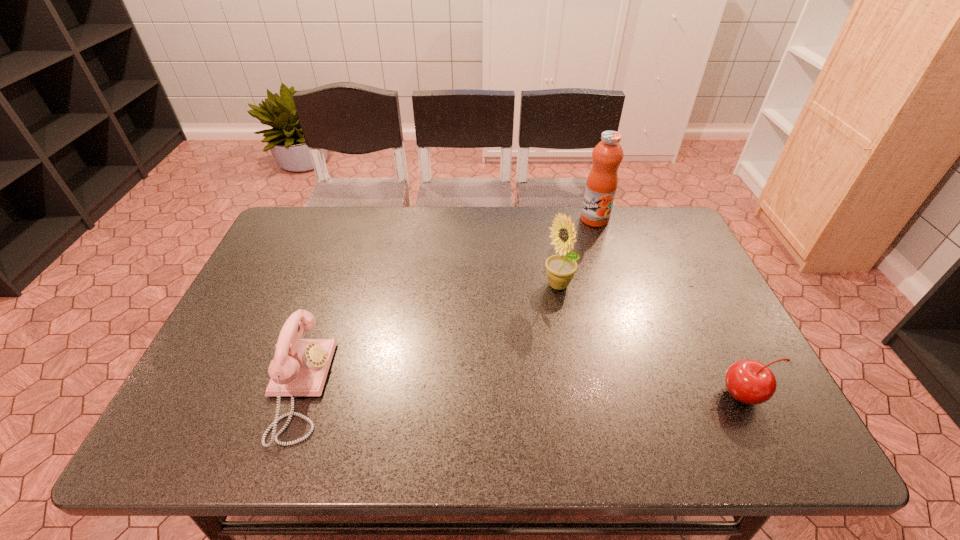
At what (x,y) coordinates should I click in order to perform the action: click on vacant space situated on the face of the second tallest object. Please return your answer as a coordinate pair (x, y). This screenshot has width=960, height=540. Looking at the image, I should click on tap(539, 322).

Find the location of a particular element. The height and width of the screenshot is (540, 960). blank space located 0.320m on the face of the second tallest object is located at coordinates (500, 386).

The height and width of the screenshot is (540, 960). Find the location of `vacant area situated on the face of the second tallest object`. vacant area situated on the face of the second tallest object is located at coordinates (518, 355).

I want to click on free space located on the front label of the tallest object, so click(565, 309).

You are a GUI agent. You are given a task and a screenshot of the screen. Output one action in this format:
    pyautogui.click(x=<x>, y=<y>)
    Task: Click on the vacant area located 0.260m on the front label of the tallest object
    
    Given the screenshot: What is the action you would take?
    pyautogui.click(x=575, y=278)

You are a GUI agent. You are given a task and a screenshot of the screen. Output one action in this format:
    pyautogui.click(x=<x>, y=<y>)
    Task: Click on the vacant region located 0.320m on the front label of the tallest object
    This screenshot has height=540, width=960.
    Given the screenshot: What is the action you would take?
    571,292

Identify the location of object that is positioned at the far edge. This screenshot has height=540, width=960. (607, 155).

Identify the location of telephone located in the near edge section of the desktop. This screenshot has width=960, height=540. (300, 366).

Find the location of `cherry that is at the near edge`. cherry that is at the near edge is located at coordinates (750, 382).

At what (x,y) coordinates should I click in order to perform the action: click on object located at the right edge. Please return your answer as a coordinate pair (x, y). Looking at the image, I should click on (750, 382).